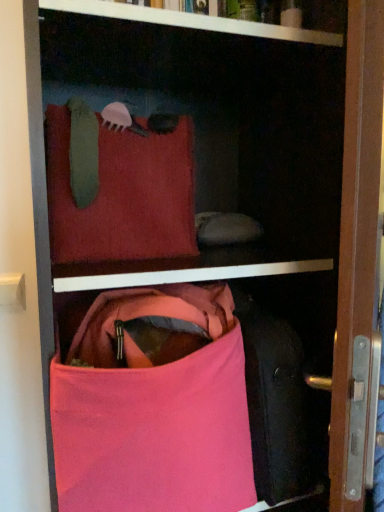
Question: Considering the positions of pink fabric handbag at lower center and velvet red pillow at upper center in the image, is pink fabric handbag at lower center bigger or smaller than velvet red pillow at upper center?

Choices:
 (A) big
 (B) small

Answer: (A)

Question: Visually, is pink fabric handbag at lower center positioned to the left or to the right of velvet red pillow at upper center?

Choices:
 (A) left
 (B) right

Answer: (B)

Question: Is pink fabric handbag at lower center taller or shorter than velvet red pillow at upper center?

Choices:
 (A) tall
 (B) short

Answer: (A)

Question: Considering the positions of velvet red pillow at upper center and pink fabric handbag at lower center in the image, is velvet red pillow at upper center bigger or smaller than pink fabric handbag at lower center?

Choices:
 (A) small
 (B) big

Answer: (A)

Question: From the image's perspective, is velvet red pillow at upper center located above or below pink fabric handbag at lower center?

Choices:
 (A) above
 (B) below

Answer: (A)

Question: Does point (69, 207) appear closer or farther from the camera than point (72, 418)?

Choices:
 (A) closer
 (B) farther

Answer: (B)

Question: In the image, is velvet red pillow at upper center positioned in front of or behind pink fabric handbag at lower center?

Choices:
 (A) front
 (B) behind

Answer: (B)